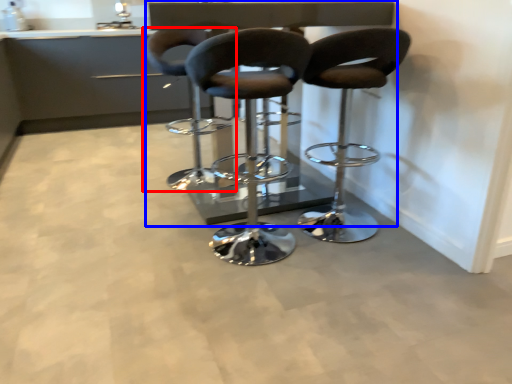
Question: Which point is further to the camera, chair (highlighted by a red box) or table (highlighted by a blue box)?

Choices:
 (A) chair
 (B) table

Answer: (A)